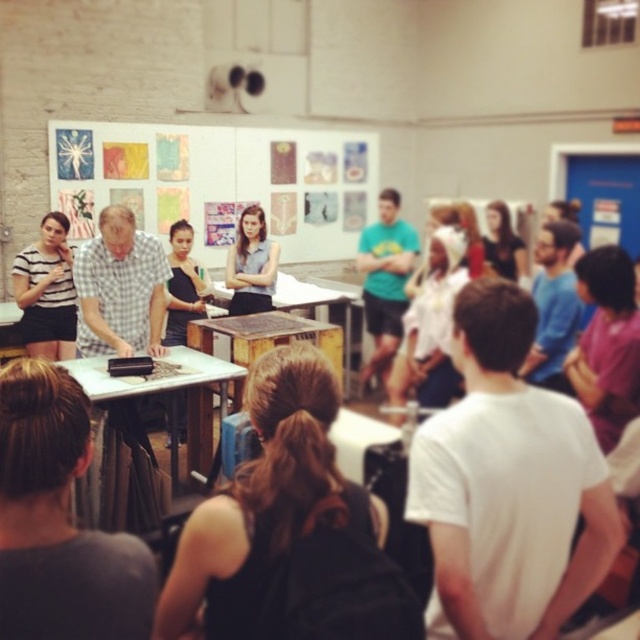
You are attending a workshop and notice two people in the front row. One is wearing a striped fabric shirt at left and the other a matte gray shirt at center. From your perspective, which person is positioned lower in the image?

The striped fabric shirt at left is positioned below the matte gray shirt at center, so the person wearing the striped fabric shirt at left is lower in the image.

You are a photographer taking a picture of the group. You want to ensure both the brown hair at center and the striped fabric shirt at left are clearly visible in the frame. Based on their positions, which object should you focus on first to capture both in the shot?

The striped fabric shirt at left should be focused on first since the brown hair at center is positioned to the right of it, ensuring both are within the frame when starting from the left side.

You are standing in the room and want to move from the point at coordinates point (13, 280) to the point at coordinates point (257, 262). Which direction should you move to reach your destination?

To move from point (13, 280) to point (257, 262), you should move backward since point (13, 280) is in front of point (257, 262).